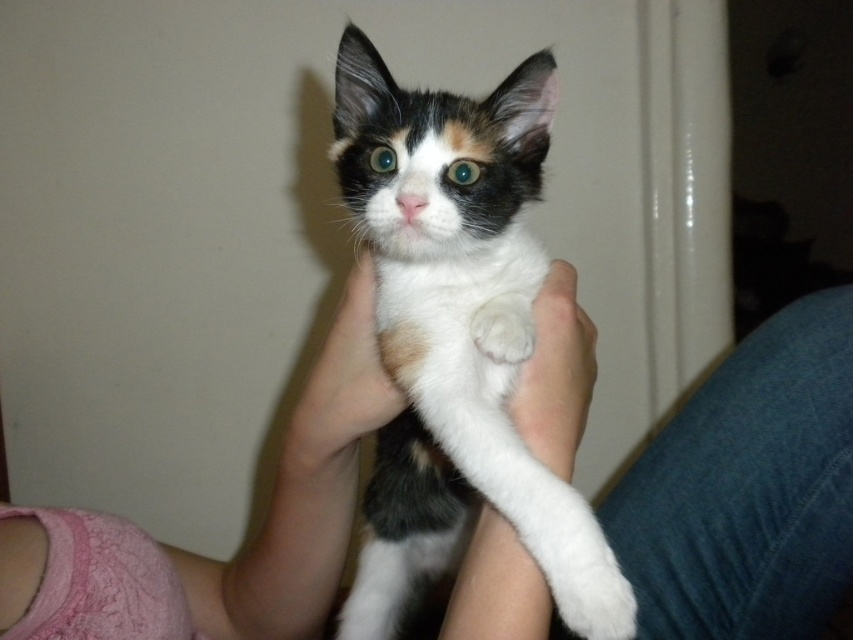
You are a veterinarian examining a cat. You notice the calico fur cat at center and the white fluffy paw at center in the image. Which object is positioned lower in the image?

The calico fur cat at center is located below the white fluffy paw at center, so the calico fur cat at center is positioned lower in the image.

You are a veterinarian examining a cat and need to check its paw. The calico fur cat at center is currently being held by someone. Can you reach the white fluffy paw at center without moving the cat?

The distance between the calico fur cat at center and the white fluffy paw at center is 5.64 inches. Since the paw is part of the cat, you can reach it while examining the cat without needing to move the cat itself.